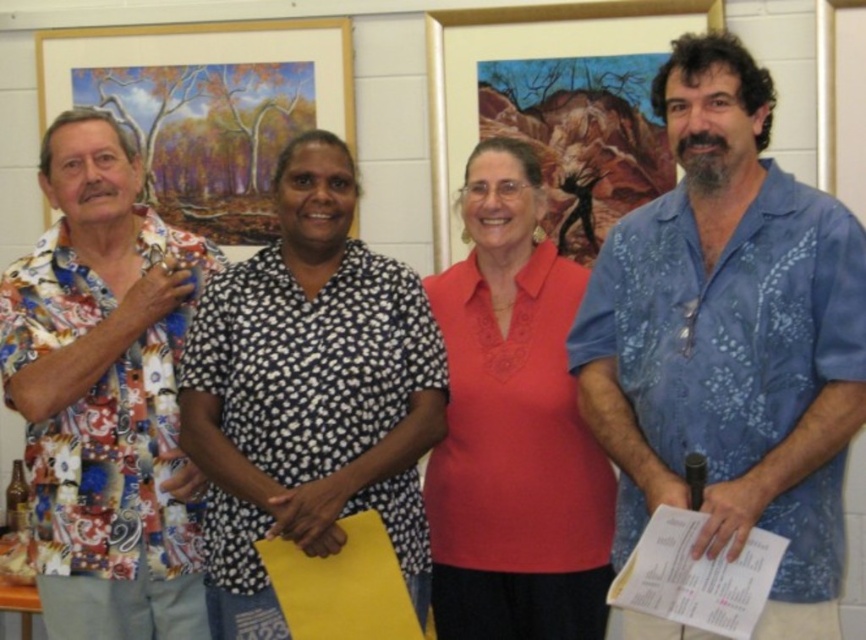
Which of these two, blue floral shirt at center or matte coral blouse at center, stands shorter?

blue floral shirt at center

Which is below, blue floral shirt at center or matte coral blouse at center?

matte coral blouse at center

Does point (722, 224) come closer to viewer compared to point (505, 508)?

That is True.

The width and height of the screenshot is (866, 640). I want to click on blue floral shirt at center, so click(729, 339).

Which is above, black dotted shirt at center or printed cotton shirt at left?

printed cotton shirt at left is higher up.

Between black dotted shirt at center and printed cotton shirt at left, which one appears on the left side from the viewer's perspective?

printed cotton shirt at left is more to the left.

What do you see at coordinates (309, 394) in the screenshot? This screenshot has width=866, height=640. I see `black dotted shirt at center` at bounding box center [309, 394].

Identify the location of black dotted shirt at center. (309, 394).

In the scene shown: Who is positioned more to the right, black dotted shirt at center or matte coral blouse at center?

From the viewer's perspective, matte coral blouse at center appears more on the right side.

Does point (360, 273) come in front of point (492, 634)?

Yes, it is.

Locate an element on the screen. black dotted shirt at center is located at coordinates (309, 394).